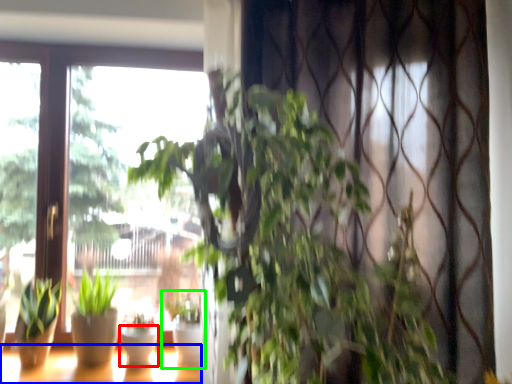
Question: Based on their relative distances, which object is farther from flowerpot (highlighted by a red box)? Choose from window (highlighted by a blue box) and houseplant (highlighted by a green box).

Choices:
 (A) window
 (B) houseplant

Answer: (B)